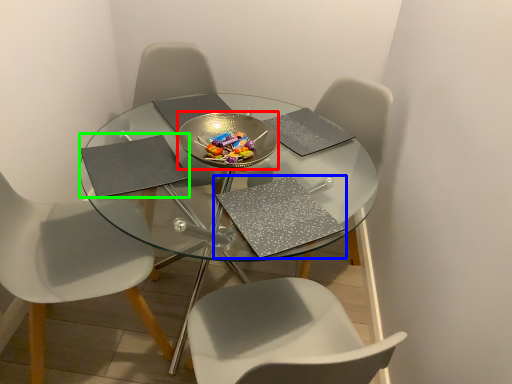
Question: Which object is positioned closest to glass plate (highlighted by a red box)? Select from pad (highlighted by a blue box) and pad (highlighted by a green box).

Choices:
 (A) pad
 (B) pad

Answer: (B)